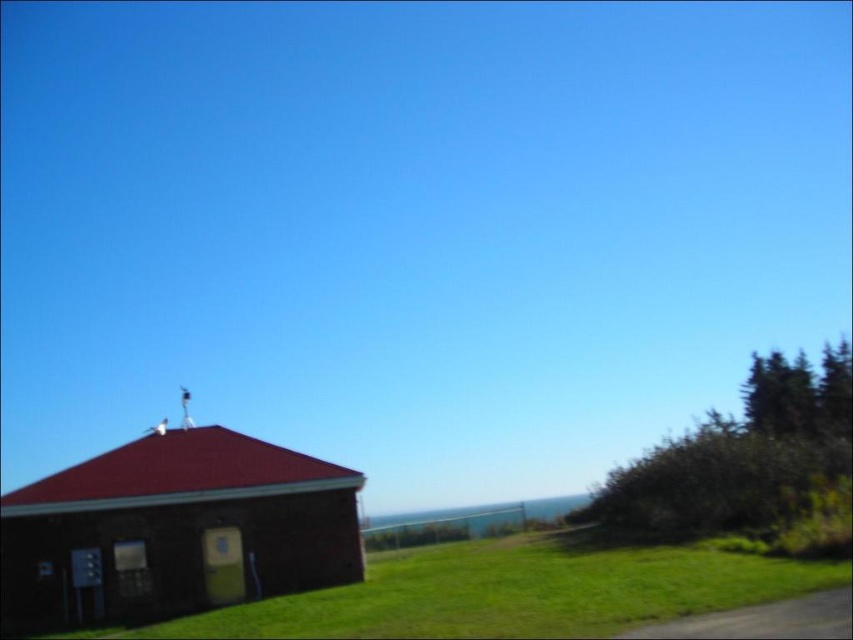
Question: Observing the image, what is the correct spatial positioning of brick-like brown hut at lower left in reference to green grass at lower right?

Choices:
 (A) below
 (B) above

Answer: (B)

Question: Can you confirm if brick-like brown hut at lower left is smaller than green grass at lower right?

Choices:
 (A) yes
 (B) no

Answer: (A)

Question: Which object is farther from the camera taking this photo?

Choices:
 (A) green grass at lower right
 (B) brick-like brown hut at lower left

Answer: (B)

Question: Can you confirm if brick-like brown hut at lower left is wider than green grass at lower right?

Choices:
 (A) no
 (B) yes

Answer: (A)

Question: Which point is closer to the camera?

Choices:
 (A) green grass at lower right
 (B) brick-like brown hut at lower left

Answer: (A)